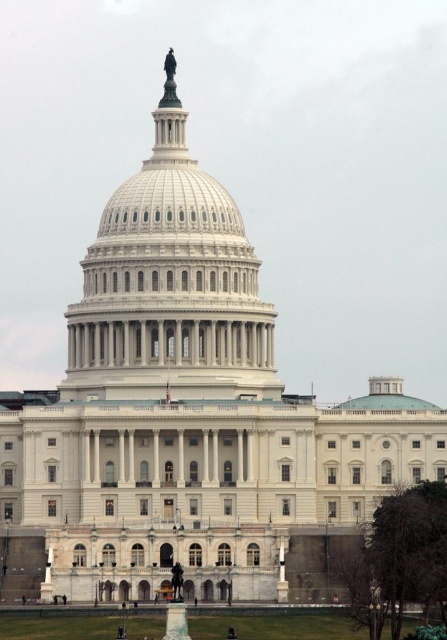
Based on the photo, you are standing in front of the United States Capitol Building and notice two points marked on the facade. The first point is at coordinates point (167, 211) and the second is at point (344, 404). From your current position, which point is closer to you?

Point (167, 211) is in front of point (344, 404), so the first point is closer to you.

You are an architect visiting the United States Capitol Building. You notice two domes in the image. Which one is taller, the white marble dome at center or the clear glass dome at center?

The white marble dome at center is taller than the clear glass dome at center according to the description.